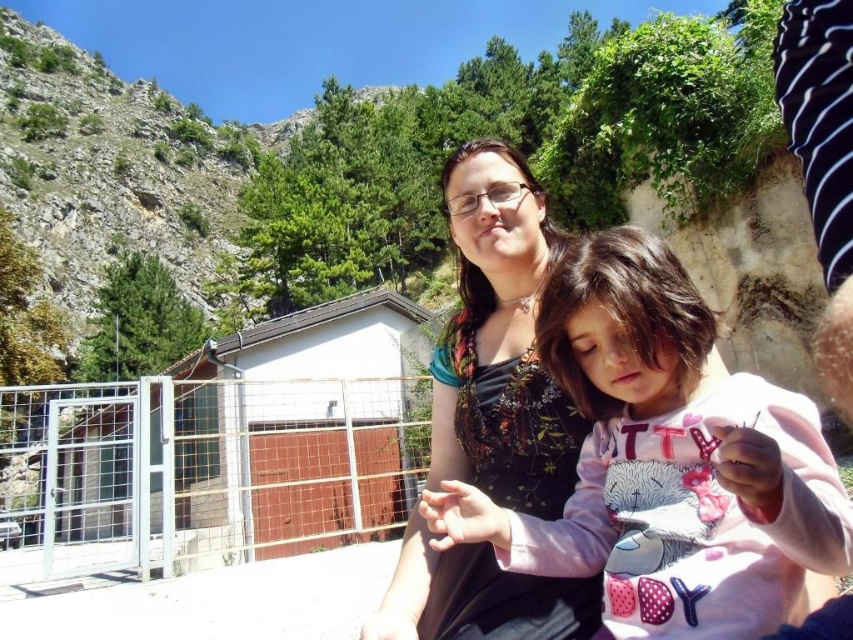
Question: Is pink fleece sweater at center to the right of matte floral dress at center from the viewer's perspective?

Choices:
 (A) yes
 (B) no

Answer: (A)

Question: Is pink fleece sweater at center smaller than matte floral dress at center?

Choices:
 (A) no
 (B) yes

Answer: (B)

Question: Does pink fleece sweater at center have a lesser width compared to matte floral dress at center?

Choices:
 (A) yes
 (B) no

Answer: (B)

Question: Among these objects, which one is farthest from the camera?

Choices:
 (A) pink fleece sweater at center
 (B) matte floral dress at center

Answer: (B)